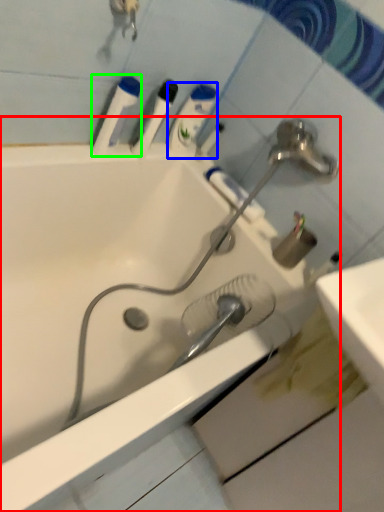
Question: Considering the real-world distances, which object is farthest from bathtub (highlighted by a red box)? mouthwash (highlighted by a blue box) or mouthwash (highlighted by a green box)?

Choices:
 (A) mouthwash
 (B) mouthwash

Answer: (A)